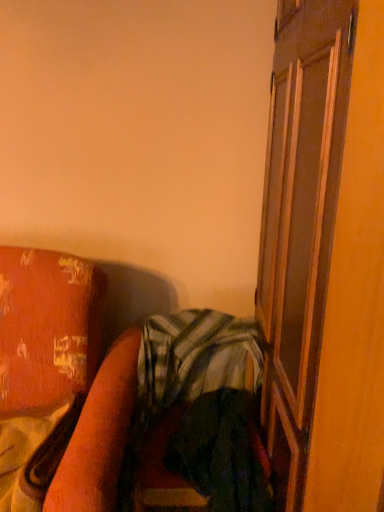
Question: In the image, is wooden bed frame at lower left positioned in front of or behind brown wooden screen door at right?

Choices:
 (A) behind
 (B) front

Answer: (A)

Question: Is point (94, 276) closer or farther from the camera than point (339, 150)?

Choices:
 (A) farther
 (B) closer

Answer: (A)

Question: Based on their relative distances, which object is nearer to the green striped fabric at center?

Choices:
 (A) wooden bed frame at lower left
 (B) brown wooden screen door at right

Answer: (A)

Question: Which of these objects is positioned closest to the brown wooden screen door at right?

Choices:
 (A) green striped fabric at center
 (B) wooden bed frame at lower left

Answer: (A)